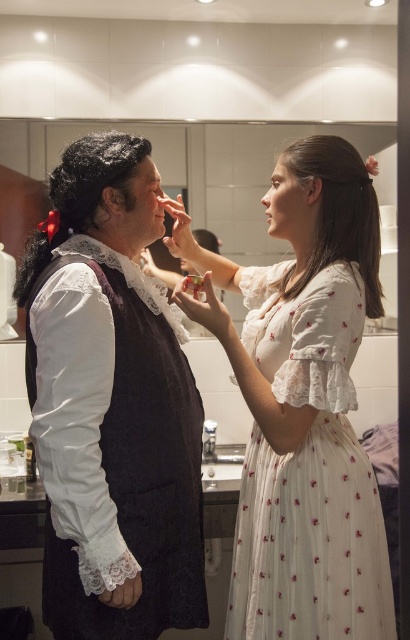
Between glossy white mirror at upper center and matte black face at upper center, which one has less height?

With less height is matte black face at upper center.

Is glossy white mirror at upper center wider than matte black face at upper center?

Indeed, glossy white mirror at upper center has a greater width compared to matte black face at upper center.

Does point (268, 173) lie behind point (148, 230)?

Yes, point (268, 173) is behind point (148, 230).

Image resolution: width=410 pixels, height=640 pixels. I want to click on glossy white mirror at upper center, so click(x=207, y=166).

Does point (59, 403) lie behind point (6, 156)?

No, (59, 403) is in front of (6, 156).

Is matte black vest at left to the right of glossy white mirror at upper center from the viewer's perspective?

In fact, matte black vest at left is to the left of glossy white mirror at upper center.

Identify the location of matte black vest at left. This screenshot has width=410, height=640. (122, 417).

At what (x,y) coordinates should I click in order to perform the action: click on matte black vest at left. Please return your answer as a coordinate pair (x, y). Image resolution: width=410 pixels, height=640 pixels. Looking at the image, I should click on 122,417.

Consider the image. Is matte black vest at left in front of smooth skin face at upper right?

Yes.

Which is behind, point (150, 605) or point (284, 189)?

Positioned behind is point (284, 189).

Which is behind, point (52, 198) or point (296, 234)?

Point (296, 234)

I want to click on matte black vest at left, so click(122, 417).